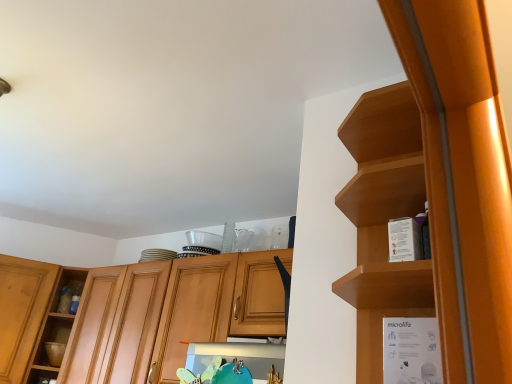
Question: Is white cardboard box at right taller than wooden shelf at upper right, which is the 2th cabinetry from left to right?

Choices:
 (A) yes
 (B) no

Answer: (B)

Question: Considering the relative positions of white cardboard box at right and wooden shelf at upper right, which appears as the second cabinetry when viewed from the back, in the image provided, is white cardboard box at right in front of wooden shelf at upper right, which appears as the second cabinetry when viewed from the back,?

Choices:
 (A) no
 (B) yes

Answer: (A)

Question: Considering the relative sizes of white cardboard box at right and wooden shelf at upper right, marked as the first cabinetry in a front-to-back arrangement, in the image provided, is white cardboard box at right bigger than wooden shelf at upper right, marked as the first cabinetry in a front-to-back arrangement,?

Choices:
 (A) yes
 (B) no

Answer: (B)

Question: Considering the relative positions of white cardboard box at right and wooden shelf at upper right, which appears as the second cabinetry when viewed from the back, in the image provided, is white cardboard box at right to the left of wooden shelf at upper right, which appears as the second cabinetry when viewed from the back, from the viewer's perspective?

Choices:
 (A) yes
 (B) no

Answer: (B)

Question: From the image's perspective, is white cardboard box at right on top of wooden shelf at upper right, which is the first cabinetry in right-to-left order?

Choices:
 (A) no
 (B) yes

Answer: (A)

Question: Can you confirm if white cardboard box at right is thinner than wooden shelf at upper right, which appears as the second cabinetry when viewed from the back?

Choices:
 (A) no
 (B) yes

Answer: (B)

Question: Is wooden cabinet at center, which is the second cabinetry in front-to-back order, thinner than white cardboard box at right?

Choices:
 (A) yes
 (B) no

Answer: (B)

Question: Is wooden cabinet at center, acting as the 2th cabinetry starting from the right, at the left side of white cardboard box at right?

Choices:
 (A) yes
 (B) no

Answer: (A)

Question: Is wooden cabinet at center, acting as the 2th cabinetry starting from the right, next to white cardboard box at right and touching it?

Choices:
 (A) no
 (B) yes

Answer: (A)

Question: Is wooden cabinet at center, arranged as the first cabinetry when viewed from the left, positioned behind white cardboard box at right?

Choices:
 (A) yes
 (B) no

Answer: (A)

Question: From a real-world perspective, is wooden cabinet at center, arranged as the first cabinetry when viewed from the left, physically above white cardboard box at right?

Choices:
 (A) no
 (B) yes

Answer: (B)

Question: Is wooden cabinet at center, which is the second cabinetry in front-to-back order, positioned with its back to white cardboard box at right?

Choices:
 (A) no
 (B) yes

Answer: (A)

Question: Is white cardboard box at right to the left of wooden cabinet at center, acting as the 2th cabinetry starting from the right, from the viewer's perspective?

Choices:
 (A) yes
 (B) no

Answer: (B)